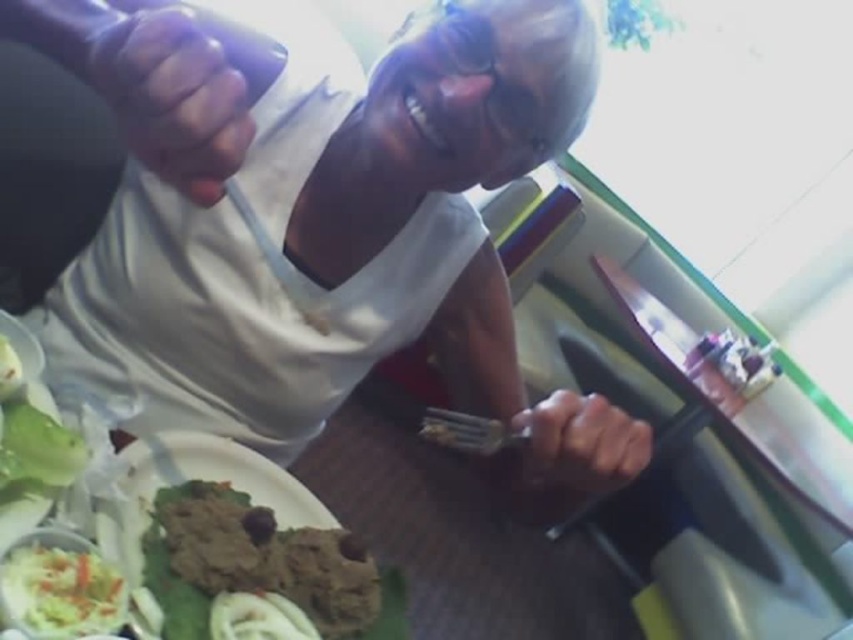
You are a photographer standing in the room and want to take a closeup shot of the wooden table at center. However, there is a smooth skin hand at lower center in the way. Can you move the hand to capture the table without obstruction?

The wooden table at center is further to the viewer than the smooth skin hand at lower center, so the hand is closer to the photographer. Moving the hand would allow the photographer to capture the table without obstruction.

You are a photographer trying to capture a closeup of the brown matte food at lower left without including the white matte shirt at upper center in the frame. Is this possible based on their positions?

The white matte shirt at upper center is in front of the brown matte food at lower left, so it would block the view. You cannot capture a closeup of the brown matte food at lower left without including the white matte shirt at upper center in the frame.

You are a guest at a dinner party and want to reach for the brown matte food at lower left. Since you are sitting across from the wooden table at center, will you need to stretch your arm over the table to reach it?

The brown matte food at lower left is positioned over the wooden table at center, so yes, you will need to stretch your arm over the wooden table at center to reach it.